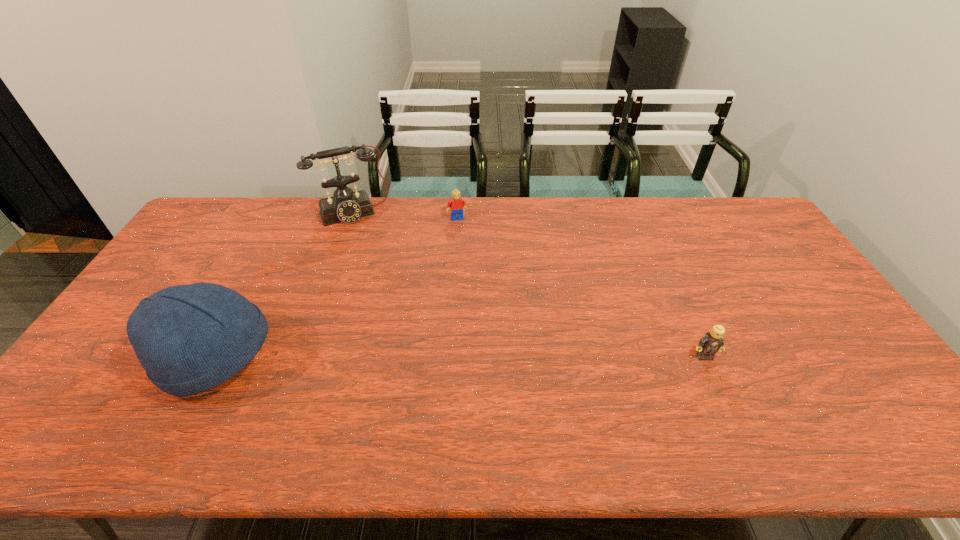
Find the location of a particular element. free location located on the face of the second object from right to left is located at coordinates (468, 246).

At what (x,y) coordinates should I click in order to perform the action: click on vacant space located 0.050m on the dial of the telephone. Please return your answer as a coordinate pair (x, y). Looking at the image, I should click on (367, 233).

Identify the location of vacant space located on the dial of the telephone. The width and height of the screenshot is (960, 540). (376, 256).

Find the location of `blank area located 0.220m on the dial of the telephone`. blank area located 0.220m on the dial of the telephone is located at coordinates (379, 264).

Locate an element on the screen. The image size is (960, 540). Lego positioned at the far edge is located at coordinates (457, 204).

This screenshot has height=540, width=960. I want to click on telephone at the far edge, so click(346, 206).

Identify the location of object present at the near edge. (190, 338).

Image resolution: width=960 pixels, height=540 pixels. In order to click on free region at the far edge in this screenshot , I will do `click(536, 205)`.

This screenshot has width=960, height=540. Identify the location of free space at the near edge. (300, 398).

The width and height of the screenshot is (960, 540). In order to click on vacant space at the left edge of the desktop in this screenshot , I will do `click(104, 348)`.